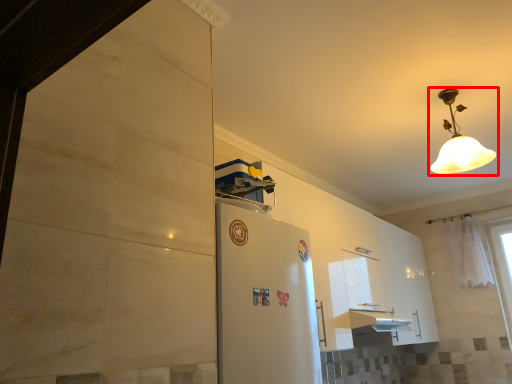
Question: From the image, what is the correct spatial relationship of lamp (annotated by the red box) in relation to curtain?

Choices:
 (A) left
 (B) right

Answer: (A)